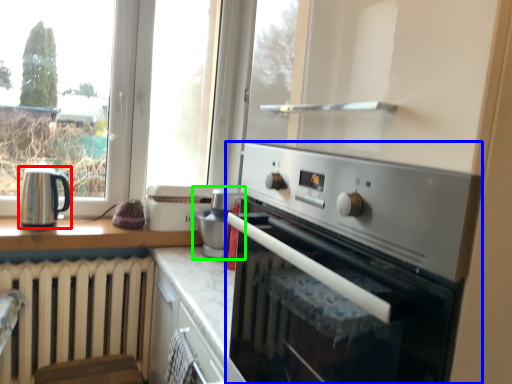
Question: Which object is positioned closest to kitchen appliance (highlighted by a red box)? Select from home appliance (highlighted by a blue box) and appliance (highlighted by a green box).

Choices:
 (A) home appliance
 (B) appliance

Answer: (B)